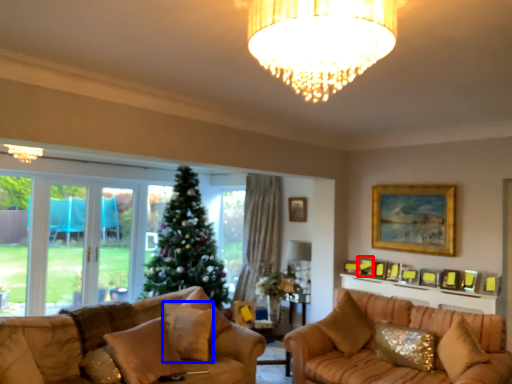
Question: Which of the following is the closest to the observer, picture frame (highlighted by a red box) or pillow (highlighted by a blue box)?

Choices:
 (A) picture frame
 (B) pillow

Answer: (B)